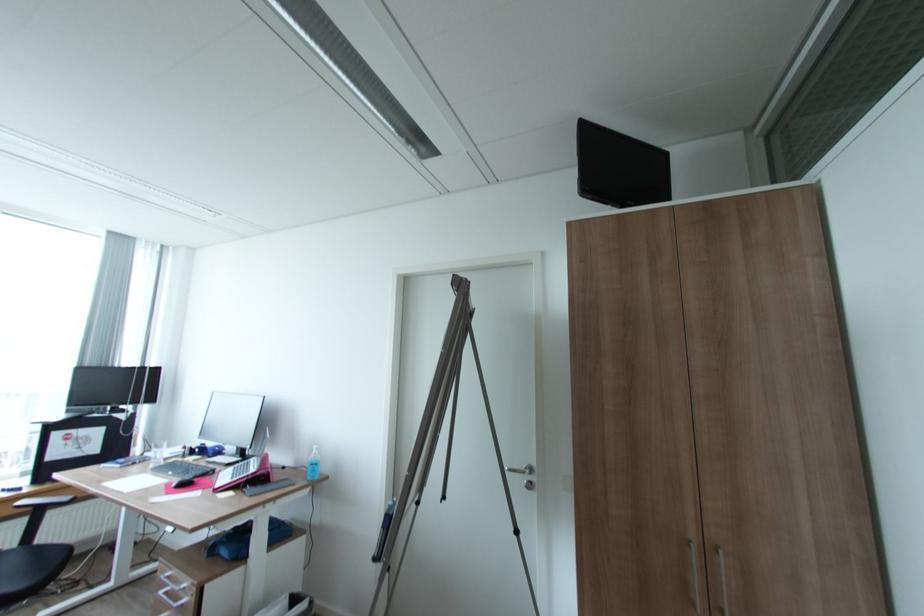
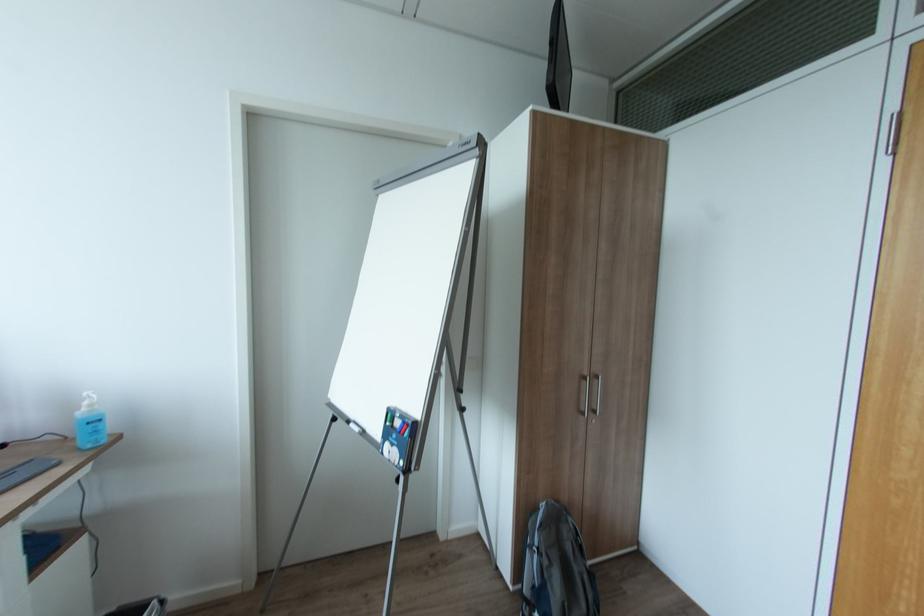
Question: The first image is from the beginning of the video and the second image is from the end. How did the camera likely rotate when shooting the video?

Choices:
 (A) Left
 (B) Right
 (C) Up
 (D) Down

Answer: (B)